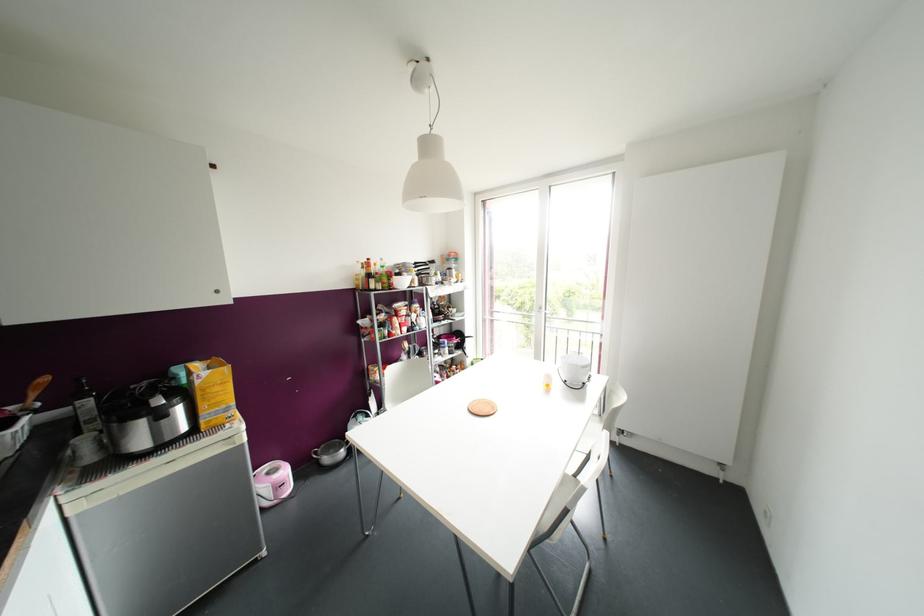
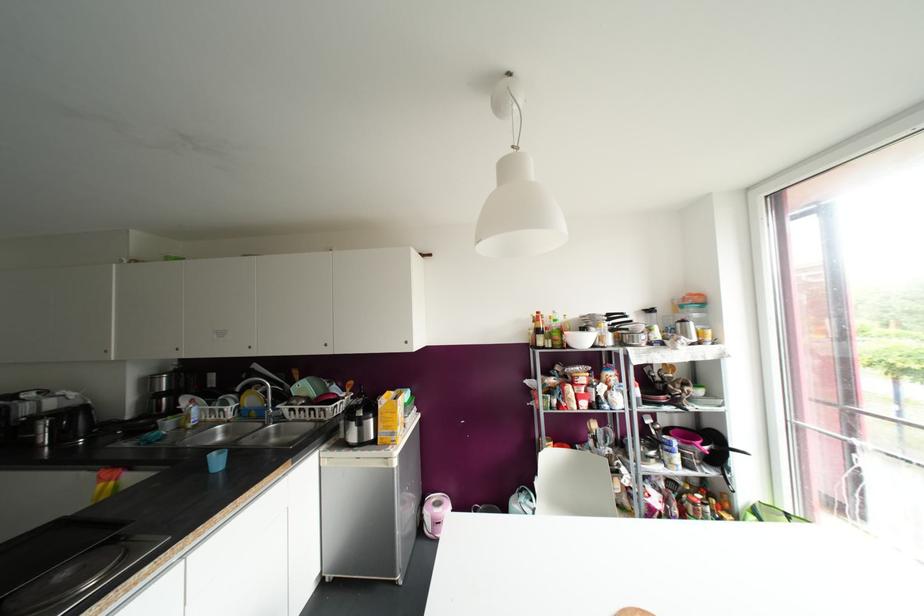
Question: Based on the continuous images, in which direction is the camera rotating? Reply with the corresponding letter.

Choices:
 (A) Left
 (B) Right
 (C) Up
 (D) Down

Answer: (A)